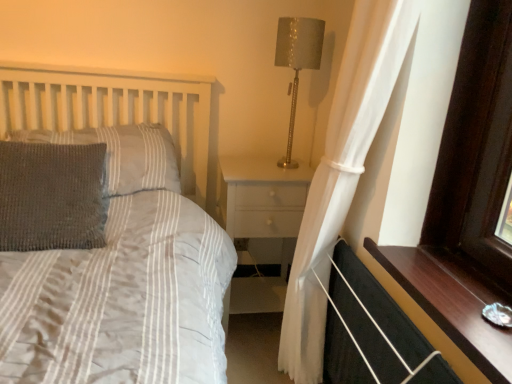
Question: Relative to gray knitted pillow at left, acting as the first pillow starting from the front, is woolen gray pillow at left, acting as the 2th pillow starting from the front, in front or behind?

Choices:
 (A) behind
 (B) front

Answer: (A)

Question: From a real-world perspective, is woolen gray pillow at left, acting as the 2th pillow starting from the front, positioned above or below gray knitted pillow at left, acting as the first pillow starting from the front?

Choices:
 (A) below
 (B) above

Answer: (B)

Question: Which is farther from the white wood nightstand at center?

Choices:
 (A) white sheer curtain at right
 (B) dark wood window sill at lower right
 (C) woolen gray pillow at left, positioned as the first pillow in back-to-front order
 (D) black fabric balustrade at lower right
 (E) gray knitted pillow at left, acting as the first pillow starting from the front

Answer: (E)

Question: Considering the real-world distances, which object is closest to the white sheer curtain at right?

Choices:
 (A) metallic gold table lamp at upper right
 (B) gray knitted pillow at left, marked as the 2th pillow in a back-to-front arrangement
 (C) black fabric balustrade at lower right
 (D) dark wood window sill at lower right
 (E) woolen gray pillow at left, positioned as the first pillow in back-to-front order

Answer: (C)